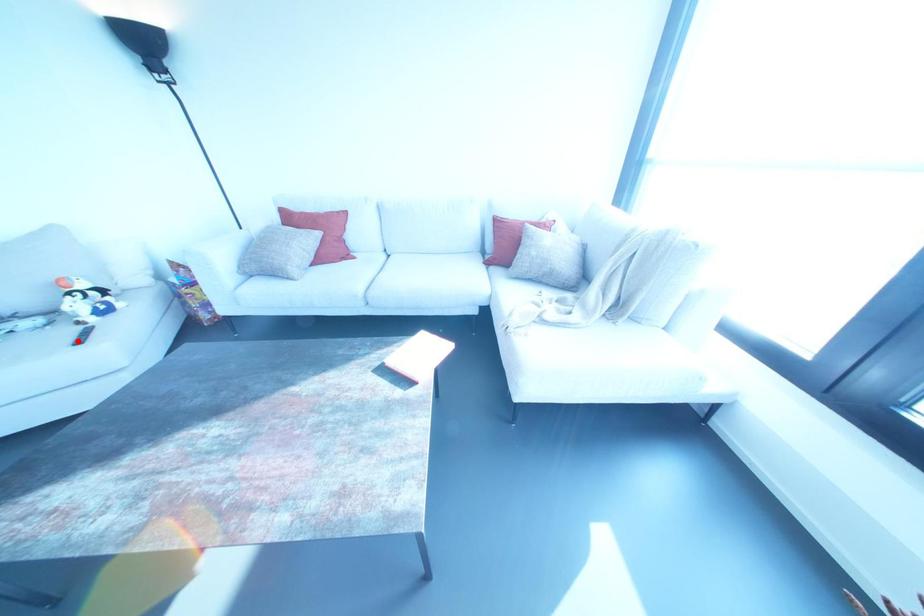
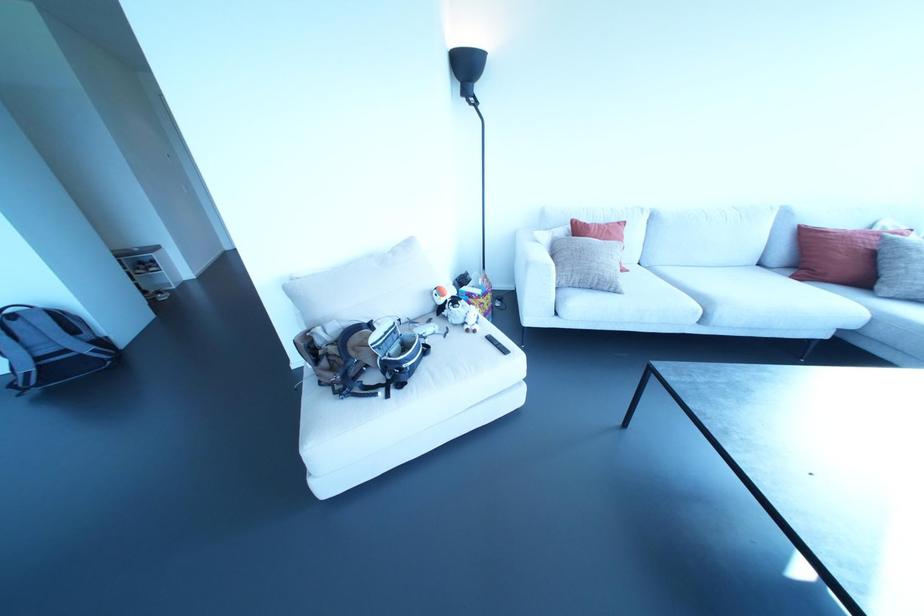
Where in the second image is the point corresponding to the highlighted location from the first image?

(504, 351)